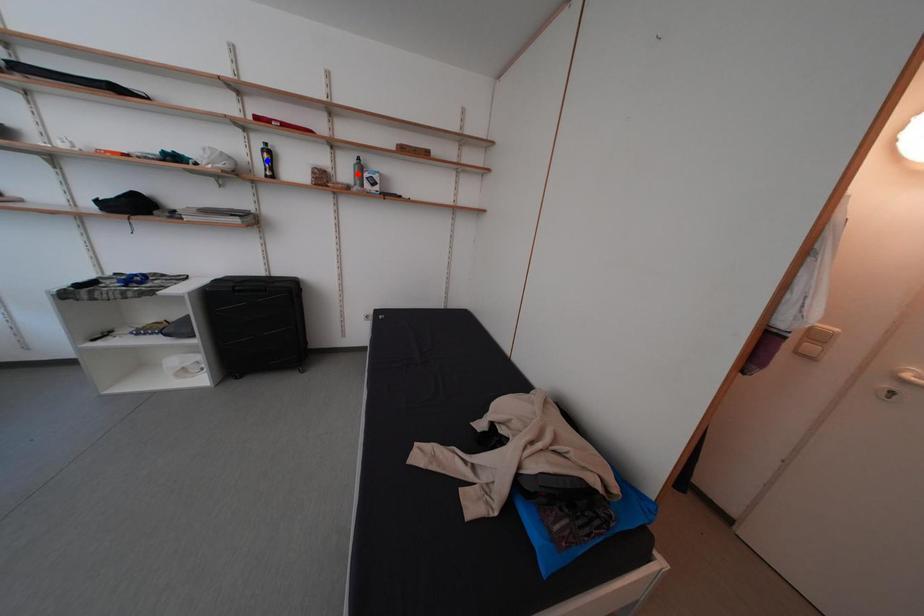
Question: Which of the two points in the image is closer to the camera?

Choices:
 (A) Blue point is closer.
 (B) Red point is closer.

Answer: (A)